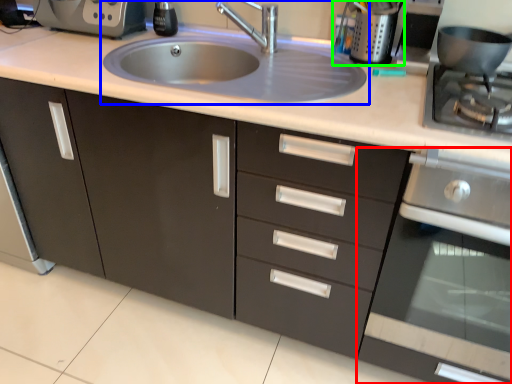
Question: Considering the real-world distances, which object is farthest from oven (highlighted by a red box)? sink (highlighted by a blue box) or appliance (highlighted by a green box)?

Choices:
 (A) sink
 (B) appliance

Answer: (B)